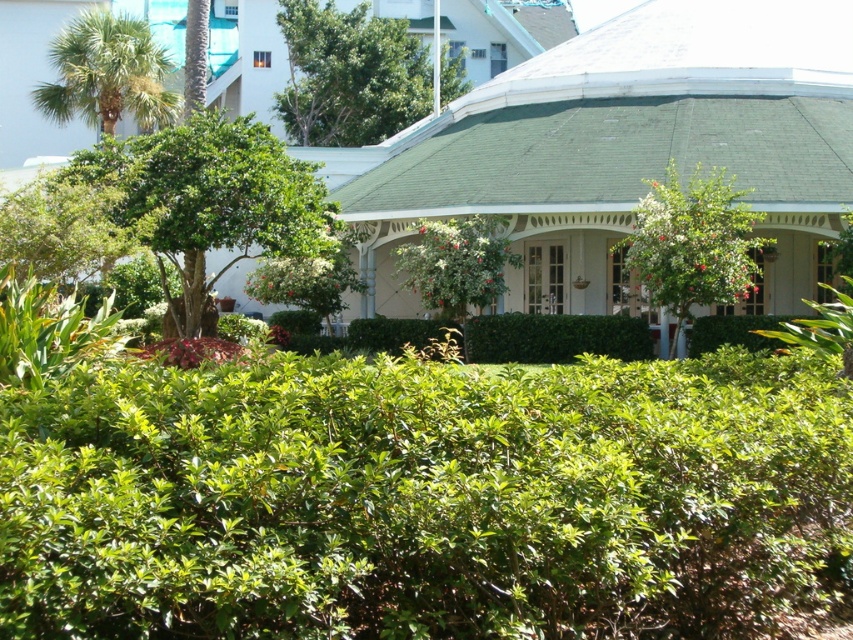
Question: Which object appears farthest from the camera in this image?

Choices:
 (A) green leafy palm tree at upper left
 (B) green leafy tree at left
 (C) green leafy hedge at center
 (D) green leafy tree at upper center

Answer: (D)

Question: Is green leafy hedge at center to the right of green leafy tree at center from the viewer's perspective?

Choices:
 (A) no
 (B) yes

Answer: (A)

Question: Is green leafy tree at upper center positioned in front of green leafy tree at center?

Choices:
 (A) no
 (B) yes

Answer: (A)

Question: Does green leafy tree at upper center have a greater width compared to green leafy palm tree at upper left?

Choices:
 (A) yes
 (B) no

Answer: (A)

Question: Which point appears closest to the camera in this image?

Choices:
 (A) (328, 244)
 (B) (90, 58)
 (C) (708, 205)

Answer: (C)

Question: Which point is farther to the camera?

Choices:
 (A) green leafy tree at center
 (B) green leafy tree at left

Answer: (B)